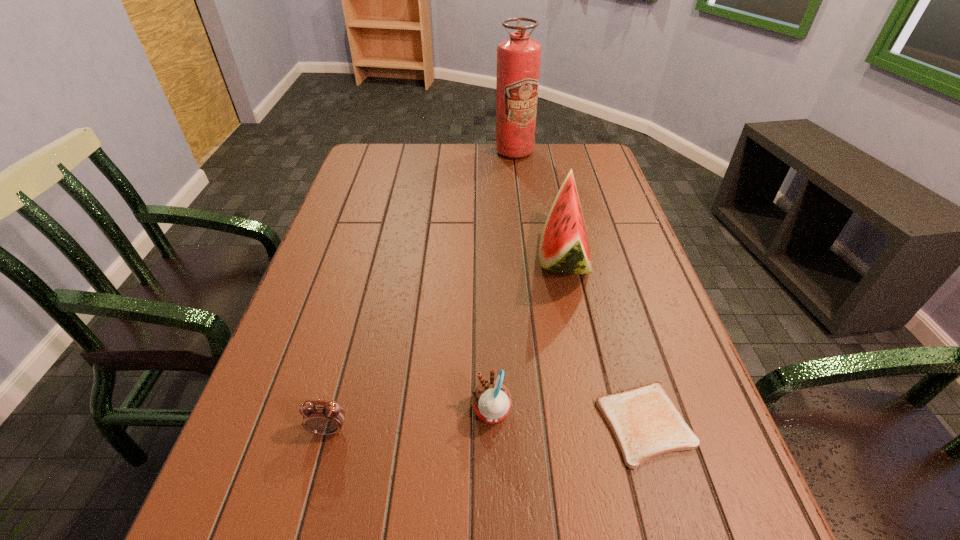
Image resolution: width=960 pixels, height=540 pixels. Find the location of `the farthest object`. the farthest object is located at coordinates [x=518, y=58].

Locate an element on the screen. The height and width of the screenshot is (540, 960). the tallest object is located at coordinates (518, 58).

Locate an element on the screen. This screenshot has height=540, width=960. watermelon is located at coordinates (564, 248).

Locate an element on the screen. The height and width of the screenshot is (540, 960). the second farthest object is located at coordinates (564, 248).

The width and height of the screenshot is (960, 540). What are the coordinates of `muffin` in the screenshot? It's located at (491, 399).

The width and height of the screenshot is (960, 540). Identify the location of the leftmost object. [x=321, y=417].

What are the coordinates of `toast` in the screenshot? It's located at (646, 423).

Where is `free location located on the label side of the tallest object`? This screenshot has height=540, width=960. free location located on the label side of the tallest object is located at coordinates (517, 181).

Where is `free space located on the outer rind of the fourth shortest object`? Image resolution: width=960 pixels, height=540 pixels. free space located on the outer rind of the fourth shortest object is located at coordinates (449, 256).

Find the location of a particular element. The height and width of the screenshot is (540, 960). free space located on the outer rind of the fourth shortest object is located at coordinates (437, 256).